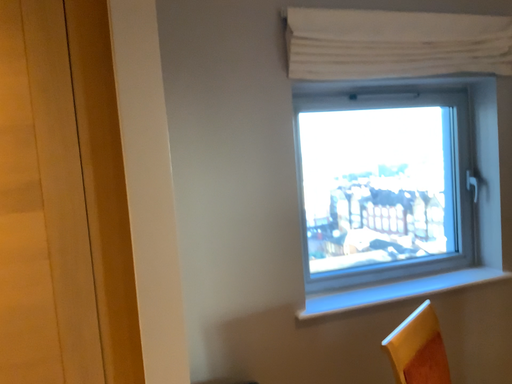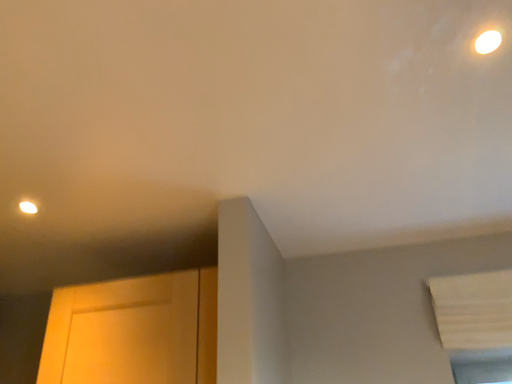
Question: Which way did the camera rotate in the video?

Choices:
 (A) rotated upward
 (B) rotated downward

Answer: (A)